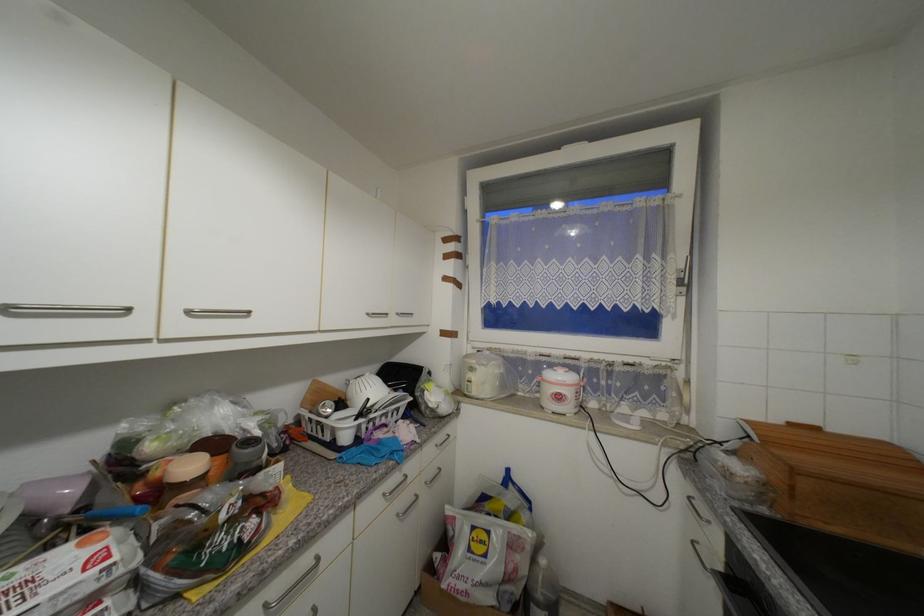
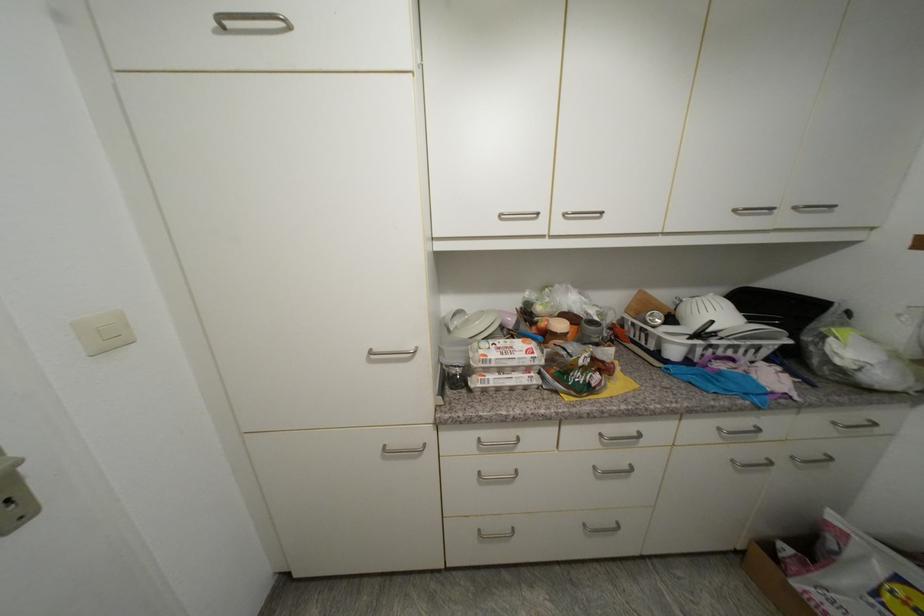
Locate, in the second image, the point that corresponds to the point at 193,313 in the first image.

(570, 216)